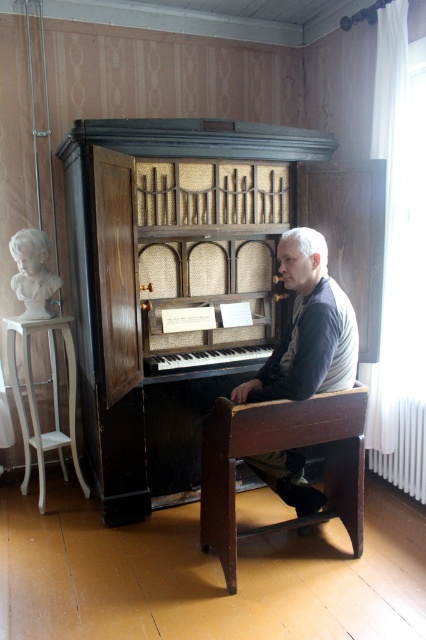
Between point (259, 413) and point (20, 324), which one is positioned in front?

Positioned in front is point (259, 413).

Which is behind, point (290, 424) or point (57, 372)?

The point (57, 372) is more distant.

Does point (284, 435) come in front of point (9, 320)?

Yes, it is.

Identify the location of brown wooden chair at lower center. This screenshot has width=426, height=640. click(x=276, y=449).

This screenshot has height=640, width=426. Describe the element at coordinates (307, 328) in the screenshot. I see `dark gray sweater at center` at that location.

Who is more forward, [287,458] or [164,364]?

Positioned in front is point [287,458].

I want to click on dark gray sweater at center, so click(x=307, y=328).

Between white wood stool at left and matte white bust at left, which one has more height?

white wood stool at left

Is point (23, 484) farther from viewer compared to point (48, 272)?

Yes, point (23, 484) is behind point (48, 272).

This screenshot has height=640, width=426. In order to click on white wood stool at left in this screenshot , I will do `click(36, 403)`.